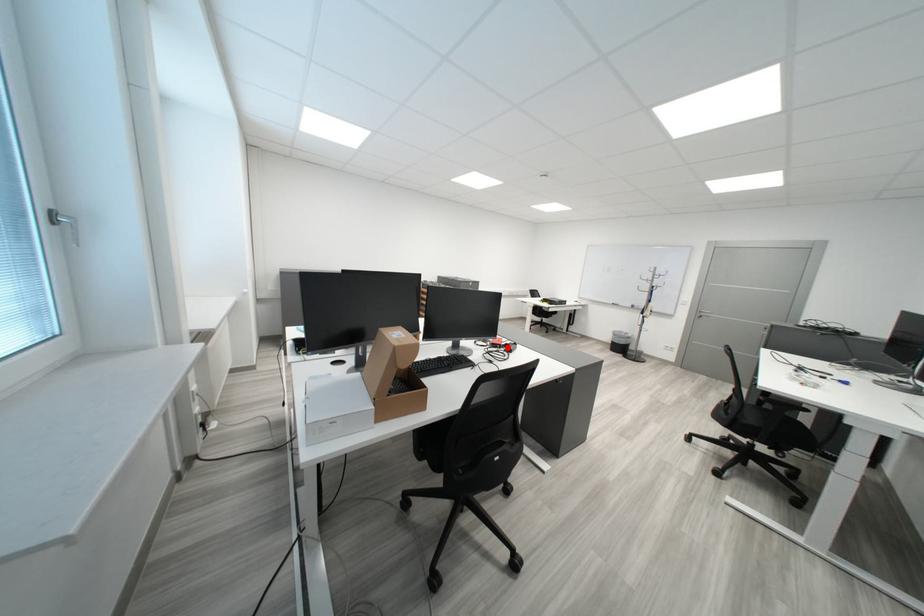
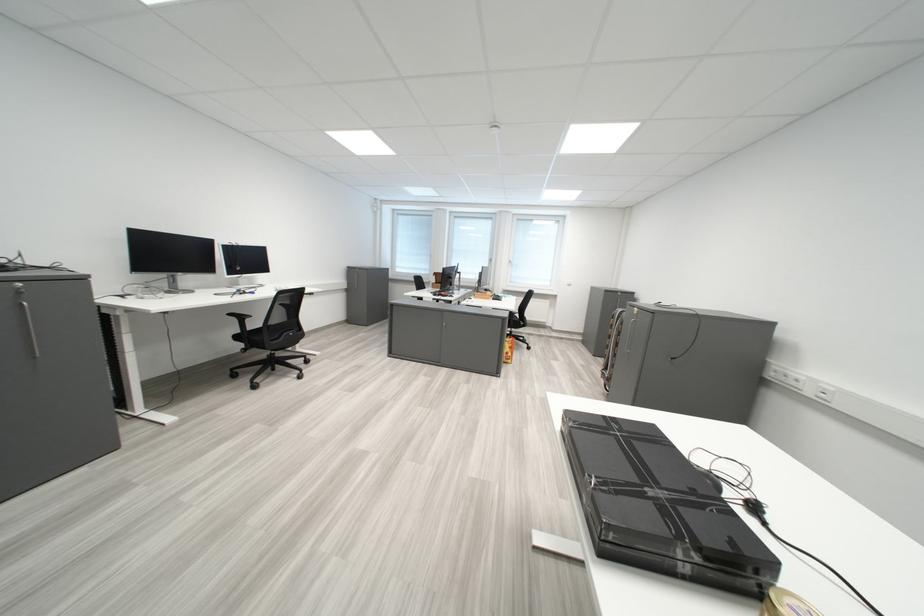
Question: I am providing you with two images of the same scene from different viewpoints. A red point is marked on the first image. At the location where the point appears in image 1, is it still visible in image 2?

Choices:
 (A) Yes
 (B) No

Answer: (B)